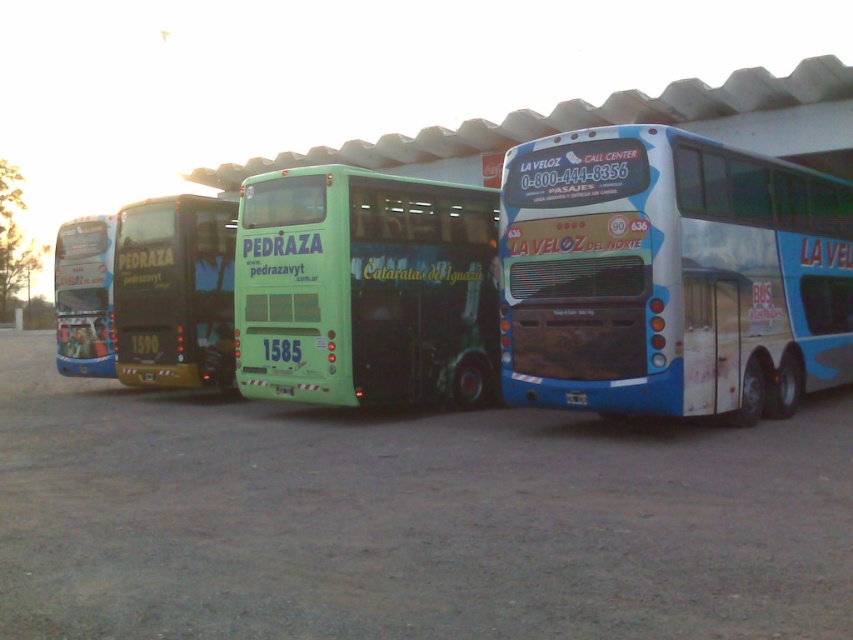
You are a delivery person needing to place a package between the blue painted bus at right and the green matte bus at center. The package requires a minimum of 20 feet of space to be safely placed. Can you fit it there?

The blue painted bus at right and green matte bus at center are 18.57 feet apart from each other, which is less than the required 20 feet. Therefore, the package cannot be safely placed between them.

You are a delivery person needing to load a 1.2 meter wide package onto a bus. You see the blue painted bus at right and the green matte bus at center. Which bus can accommodate the package width?

The blue painted bus at right is thinner than the green matte bus at center, so the green matte bus at center can accommodate the 1.2 meter wide package since it has a wider body.

You are a maintenance worker needing to reach the blue painted bus at right from the metallic gold bus at center. Given that your tool cart can only move 8 meters, will you be able to reach it without moving the buses?

The distance between the blue painted bus at right and the metallic gold bus at center is 10.09 meters, which is greater than the tool cart can move 8 meters. Therefore, you cannot reach the blue painted bus at right without moving the buses.